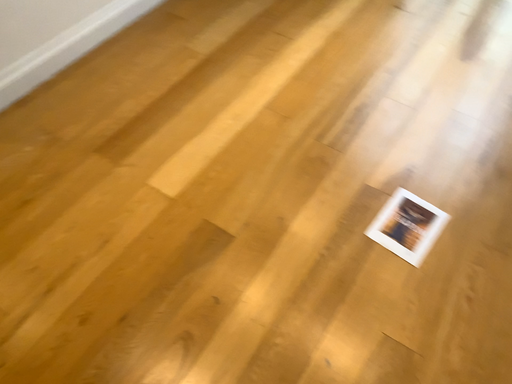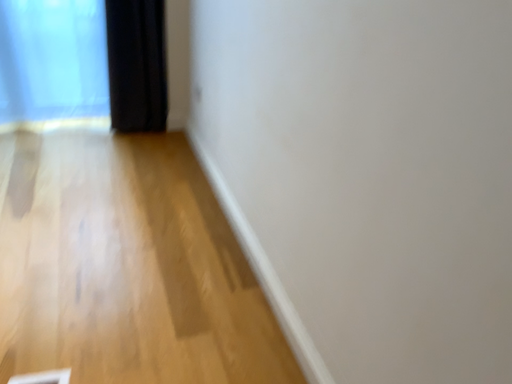
Question: How did the camera likely rotate when shooting the video?

Choices:
 (A) rotated right
 (B) rotated left

Answer: (A)